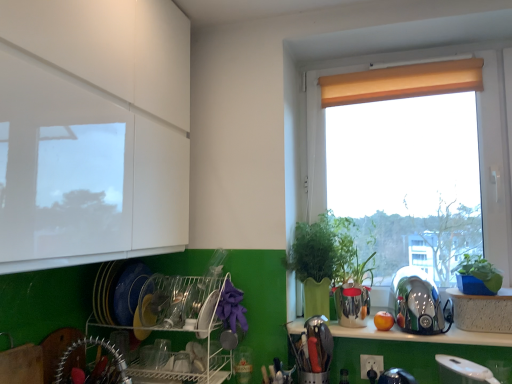
Question: Does green matte plant at right appear on the left side of metallic silver utensil holder at lower center, acting as the third appliance starting from the right?

Choices:
 (A) no
 (B) yes

Answer: (A)

Question: Does green matte plant at right have a greater height compared to metallic silver utensil holder at lower center, acting as the third appliance starting from the right?

Choices:
 (A) yes
 (B) no

Answer: (A)

Question: Is green matte plant at right next to metallic silver utensil holder at lower center, acting as the 2th appliance starting from the left?

Choices:
 (A) no
 (B) yes

Answer: (A)

Question: Is green matte plant at right looking in the opposite direction of metallic silver utensil holder at lower center, acting as the third appliance starting from the right?

Choices:
 (A) yes
 (B) no

Answer: (B)

Question: Could you tell me if green matte plant at right is turned towards metallic silver utensil holder at lower center, acting as the 2th appliance starting from the left?

Choices:
 (A) yes
 (B) no

Answer: (A)

Question: Is green matte plant at right at the right side of metallic silver utensil holder at lower center, acting as the third appliance starting from the right?

Choices:
 (A) yes
 (B) no

Answer: (A)

Question: Is beige fabric curtain at upper right positioned in front of green matte plant at right?

Choices:
 (A) yes
 (B) no

Answer: (B)

Question: From a real-world perspective, is beige fabric curtain at upper right on top of green matte plant at right?

Choices:
 (A) no
 (B) yes

Answer: (B)

Question: Is green matte plant at right located within beige fabric curtain at upper right?

Choices:
 (A) yes
 (B) no

Answer: (B)

Question: Can you confirm if beige fabric curtain at upper right is taller than green matte plant at right?

Choices:
 (A) no
 (B) yes

Answer: (A)

Question: From a real-world perspective, is beige fabric curtain at upper right located beneath green matte plant at right?

Choices:
 (A) no
 (B) yes

Answer: (A)

Question: Is beige fabric curtain at upper right positioned far away from green matte plant at right?

Choices:
 (A) no
 (B) yes

Answer: (A)

Question: Considering the relative sizes of white textured cabinet at lower right and brushed metal utensil rack at lower left, positioned as the first appliance in left-to-right order, in the image provided, is white textured cabinet at lower right thinner than brushed metal utensil rack at lower left, positioned as the first appliance in left-to-right order,?

Choices:
 (A) no
 (B) yes

Answer: (A)